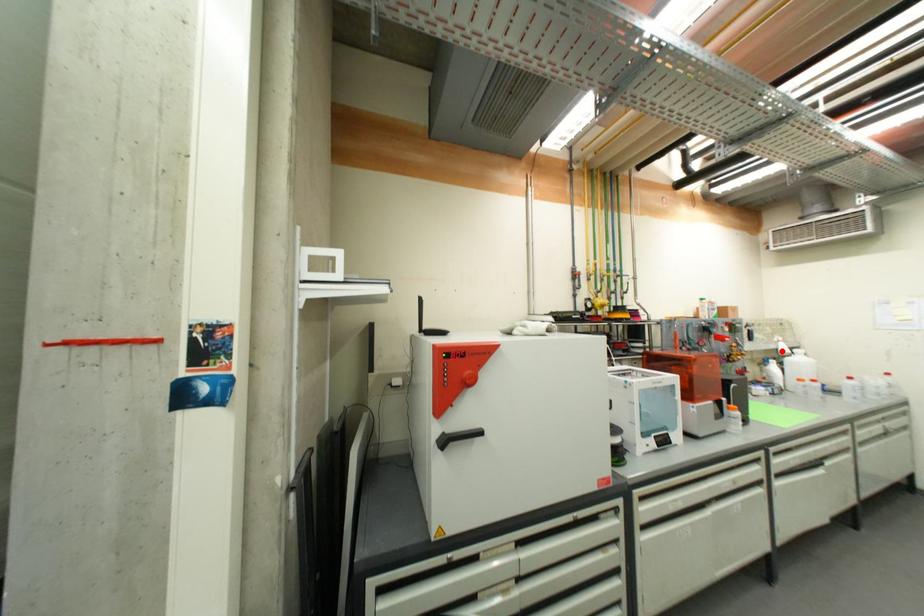
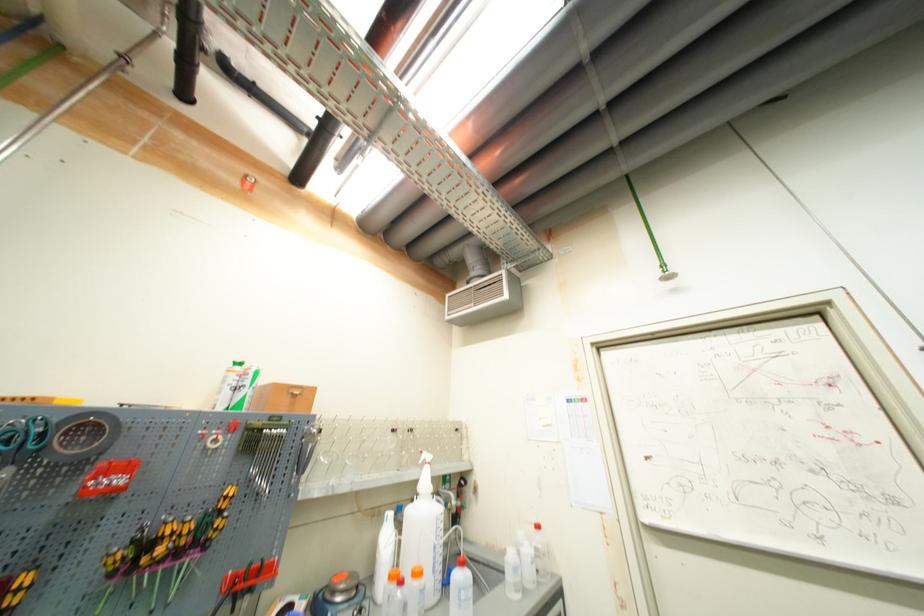
Where in the second image is the point corresponding to the highlighted location from the first image?

(421, 484)